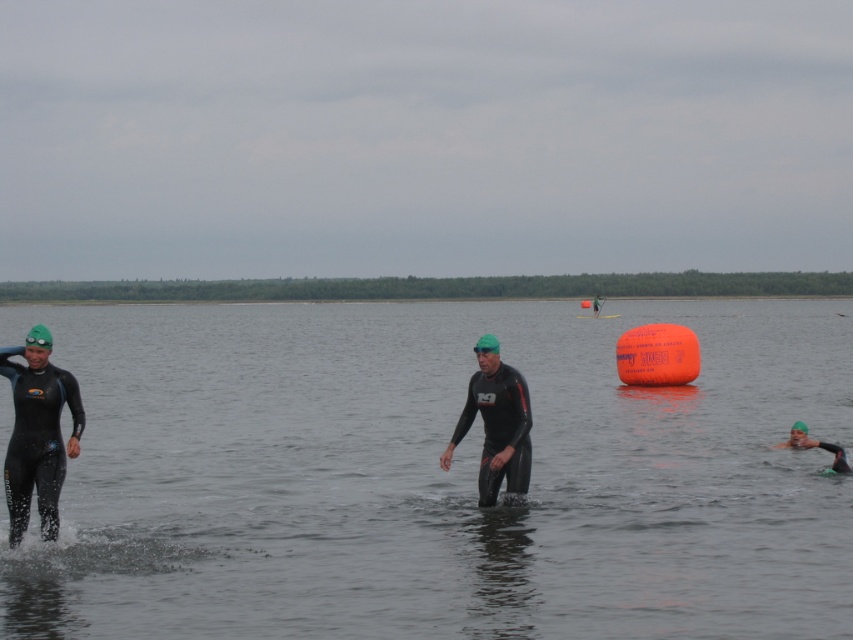
You are a photographer positioned at the edge of the water, capturing the swimmers exiting the water. You notice two black matte wetsuit at left and black matte wetsuit at center. Which swimmer is closer to you?

The black matte wetsuit at left is taller than the black matte wetsuit at center, so the swimmer in the black matte wetsuit at left is closer to you.

You are a participant in the triathlon and you see two points in the water ahead of you. The first point is at coordinates point (x=22, y=396) and the second point is at coordinates point (x=498, y=422). Which point is closer to you?

Point (x=22, y=396) is closer to the viewer than point (x=498, y=422).

You are a photographer standing at the edge of the swimming area during a triathlon. You want to capture a photo of the black matte wetsuit at center without the transparent water at center appearing in the foreground. Is this possible based on their positions?

The transparent water at center is closer to the viewer than the black matte wetsuit at center, so it would block the view of the wetsuit in the foreground. Therefore, it is not possible to capture the black matte wetsuit at center without the transparent water at center appearing in front of it.